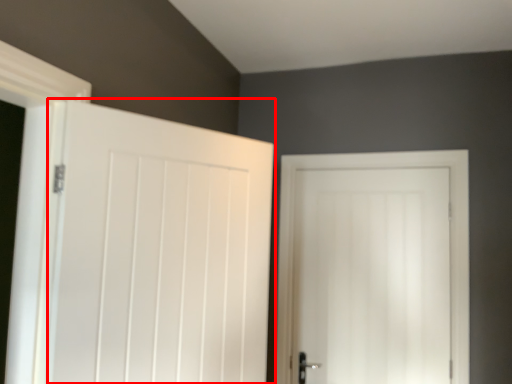
Question: Where is door (annotated by the red box) located in relation to door in the image?

Choices:
 (A) left
 (B) right

Answer: (A)